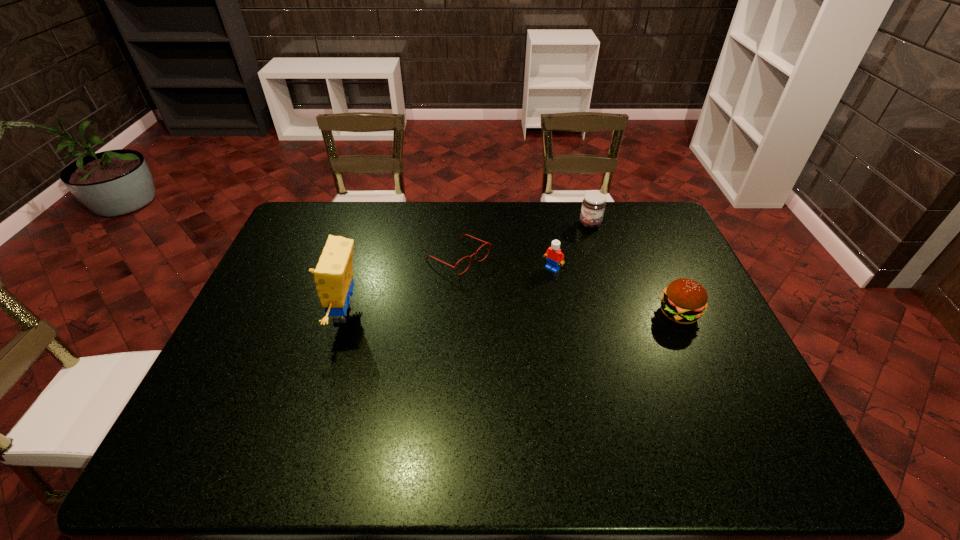
Find the location of a particular element. free space on the desktop that is between the leftmost object and the hamburger and is positioned on the face of the second object from left to right is located at coordinates (546, 314).

Identify the location of vacant space on the desktop that is between the leftmost object and the rightmost object and is positioned on the front label of the farthest object. The height and width of the screenshot is (540, 960). (535, 314).

Locate an element on the screen. The width and height of the screenshot is (960, 540). free spot on the desktop that is between the leftmost object and the hamburger and is positioned on the face of the Lego is located at coordinates (504, 314).